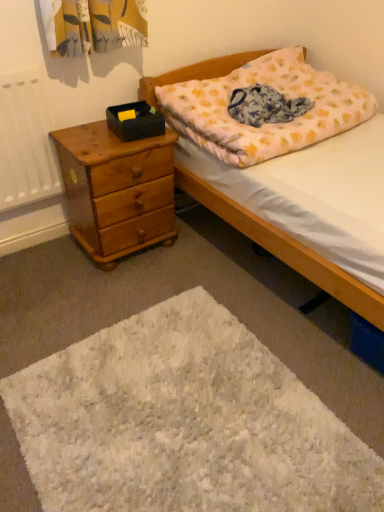
Question: Based on their sizes in the image, would you say fluffy cotton pillow at upper right is bigger or smaller than floral cotton blanket at center?

Choices:
 (A) big
 (B) small

Answer: (A)

Question: Choose the correct answer: Is fluffy cotton pillow at upper right inside floral cotton blanket at center or outside it?

Choices:
 (A) outside
 (B) inside

Answer: (A)

Question: Estimate the real-world distances between objects in this image. Which object is closer to the fluffy cotton pillow at upper right?

Choices:
 (A) floral cotton blanket at center
 (B) white fluffy mat at lower center
 (C) light brown wooden chest of drawers at left

Answer: (A)

Question: Which is farther from the floral cotton blanket at center?

Choices:
 (A) fluffy cotton pillow at upper right
 (B) white fluffy mat at lower center
 (C) light brown wooden chest of drawers at left

Answer: (B)